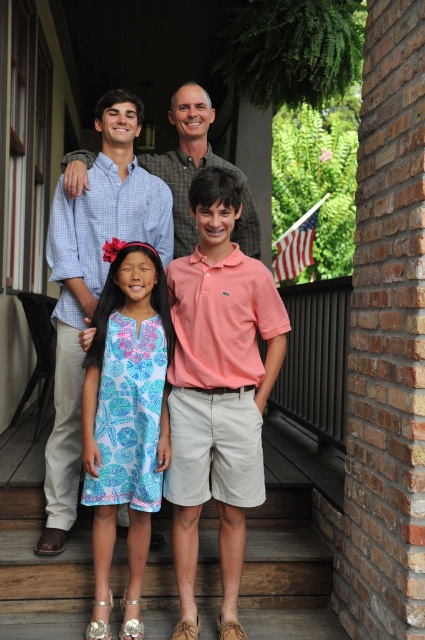
Question: Does linen dress at center appear on the left side of matte plaid shirt at upper center?

Choices:
 (A) yes
 (B) no

Answer: (A)

Question: Which point is closer to the camera taking this photo?

Choices:
 (A) (124, 428)
 (B) (122, 141)
 (C) (235, 170)

Answer: (A)

Question: Which object appears farthest from the camera in this image?

Choices:
 (A) blue floral dress at center
 (B) linen dress at center

Answer: (A)

Question: Which point is closer to the camera?

Choices:
 (A) (221, 522)
 (B) (51, 464)

Answer: (A)

Question: Is brushed metal shirt at upper center in front of matte plaid shirt at upper center?

Choices:
 (A) yes
 (B) no

Answer: (A)

Question: Can you confirm if linen dress at center is wider than brushed metal shirt at upper center?

Choices:
 (A) yes
 (B) no

Answer: (B)